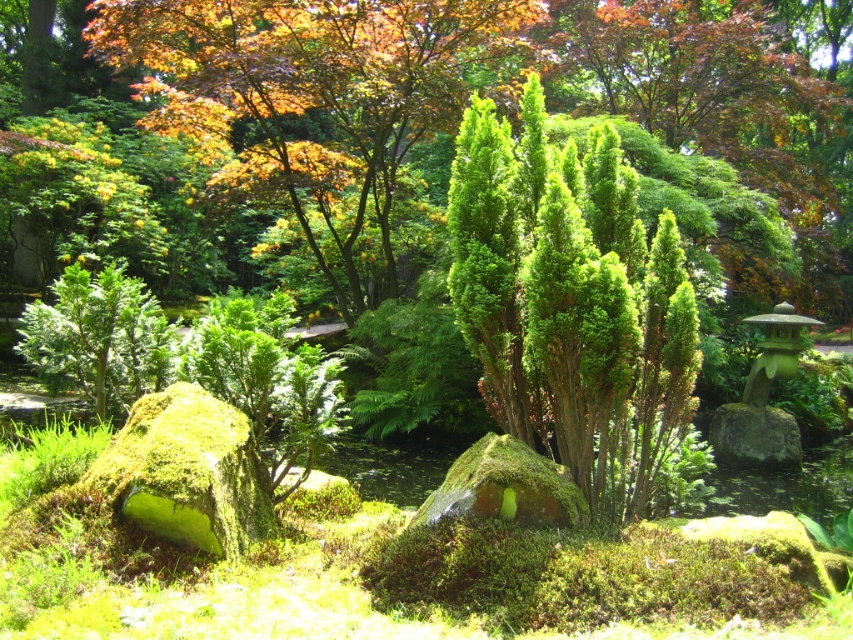
Question: Is green textured bush at center above green textured shrub at upper center?

Choices:
 (A) yes
 (B) no

Answer: (B)

Question: Does green textured bush at center have a smaller size compared to green textured shrub at upper center?

Choices:
 (A) yes
 (B) no

Answer: (B)

Question: Is green textured bush at center thinner than green textured shrub at upper center?

Choices:
 (A) no
 (B) yes

Answer: (A)

Question: Which of the following is the farthest from the observer?

Choices:
 (A) green textured bush at center
 (B) green textured shrub at upper center

Answer: (B)

Question: Which point appears farthest from the camera in this image?

Choices:
 (A) (534, 307)
 (B) (480, 40)

Answer: (B)